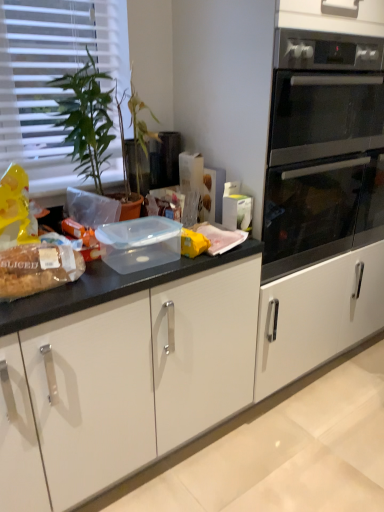
From the picture: Measure the distance between point (107, 108) and camera.

Point (107, 108) is 4.90 feet away from camera.

Locate an element on the screen. This screenshot has width=384, height=512. green glossy plant at left is located at coordinates (86, 118).

Where is `translucent plastic bread at left`? This screenshot has width=384, height=512. translucent plastic bread at left is located at coordinates (37, 269).

The height and width of the screenshot is (512, 384). What do you see at coordinates (51, 76) in the screenshot? I see `white plastic blinds at upper left` at bounding box center [51, 76].

Consider the image. In order to face white plastic blinds at upper left, should I rotate leftwards or rightwards?

It's best to rotate left around 17.920 degrees.

Where is `green glossy plant at left`? This screenshot has width=384, height=512. green glossy plant at left is located at coordinates (86, 118).

Considering the positions of point (56, 26) and point (91, 55), is point (56, 26) closer or farther from the camera than point (91, 55)?

Point (56, 26).

Does white plastic blinds at upper left have a lesser width compared to green glossy plant at left?

Yes.

From the image's perspective, is translucent plastic bread at left located above or below white plastic blinds at upper left?

translucent plastic bread at left is situated lower than white plastic blinds at upper left in the image.

Between translucent plastic bread at left and white plastic blinds at upper left, which one has smaller width?

white plastic blinds at upper left is thinner.

Consider the image. Who is bigger, translucent plastic bread at left or white plastic blinds at upper left?

white plastic blinds at upper left is bigger.

Can you confirm if white plastic blinds at upper left is smaller than translucent plastic bread at left?

No, white plastic blinds at upper left is not smaller than translucent plastic bread at left.

How distant is white plastic blinds at upper left from translucent plastic bread at left?

The distance of white plastic blinds at upper left from translucent plastic bread at left is 30.85 inches.

From a real-world perspective, is white plastic blinds at upper left above or below translucent plastic bread at left?

white plastic blinds at upper left is situated higher than translucent plastic bread at left in the real world.

Is white plastic blinds at upper left spatially inside translucent plastic bread at left, or outside of it?

The correct answer is: outside.

Does stainless steel oven at right come behind translucent plastic bread at left?

Yes, the depth of stainless steel oven at right is greater than that of translucent plastic bread at left.

Would you say stainless steel oven at right is outside translucent plastic bread at left?

Yes.

Is stainless steel oven at right far away from translucent plastic bread at left?

No, stainless steel oven at right is in close proximity to translucent plastic bread at left.

From the image's perspective, which one is positioned lower, green glossy plant at left or stainless steel oven at right?

green glossy plant at left appears lower in the image.

Can you tell me how much green glossy plant at left and stainless steel oven at right differ in facing direction?

The facing directions of green glossy plant at left and stainless steel oven at right are 6.17 degrees apart.

Does point (99, 83) lie in front of point (321, 34)?

That is False.

Considering the sizes of objects green glossy plant at left and stainless steel oven at right in the image provided, who is shorter, green glossy plant at left or stainless steel oven at right?

Standing shorter between the two is green glossy plant at left.

Where is `oven on the right of translucent plastic bread at left`? oven on the right of translucent plastic bread at left is located at coordinates (323, 148).

From a real-world perspective, is translucent plastic bread at left above or below stainless steel oven at right?

Clearly, from a real-world perspective, translucent plastic bread at left is below stainless steel oven at right.

Does point (36, 251) lie in front of point (287, 271)?

Yes, point (36, 251) is in front of point (287, 271).

Considering the sizes of translucent plastic bread at left and stainless steel oven at right in the image, is translucent plastic bread at left taller or shorter than stainless steel oven at right?

Considering their sizes, translucent plastic bread at left has less height than stainless steel oven at right.

From the picture: Between green glossy plant at left and translucent plastic bread at left, which one has larger size?

green glossy plant at left is bigger.

Is green glossy plant at left facing towards translucent plastic bread at left?

No, green glossy plant at left is not facing towards translucent plastic bread at left.

In terms of height, does green glossy plant at left look taller or shorter compared to translucent plastic bread at left?

Considering their sizes, green glossy plant at left has more height than translucent plastic bread at left.

Based on their positions, is green glossy plant at left located to the left or right of translucent plastic bread at left?

In the image, green glossy plant at left appears on the right side of translucent plastic bread at left.

Find the location of a particular element. houseplant lying below the white plastic blinds at upper left (from the image's perspective) is located at coordinates 86,118.

Find the location of a particular element. This screenshot has width=384, height=512. food located underneath the white plastic blinds at upper left (from a real-world perspective) is located at coordinates (37, 269).

From the image, which object appears to be farther from translucent plastic bread at left, stainless steel oven at right or white plastic blinds at upper left?

stainless steel oven at right is positioned further to the anchor translucent plastic bread at left.

Based on the photo, from the image, which object appears to be farther from stainless steel oven at right, green glossy plant at left or translucent plastic bread at left?

translucent plastic bread at left is positioned further to the anchor stainless steel oven at right.

Considering their positions, is translucent plastic bread at left positioned further to stainless steel oven at right than green glossy plant at left?

Based on the image, translucent plastic bread at left appears to be further to stainless steel oven at right.

Based on the photo, which object lies nearer to the anchor point translucent plastic bread at left, white plastic blinds at upper left or stainless steel oven at right?

white plastic blinds at upper left is positioned closer to the anchor translucent plastic bread at left.

Estimate the real-world distances between objects in this image. Which object is further from stainless steel oven at right, green glossy plant at left or white plastic blinds at upper left?

Based on the image, white plastic blinds at upper left appears to be further to stainless steel oven at right.

Considering their positions, is translucent plastic bread at left positioned further to green glossy plant at left than white plastic blinds at upper left?

Among the two, translucent plastic bread at left is located further to green glossy plant at left.

Looking at the image, which one is located closer to white plastic blinds at upper left, green glossy plant at left or translucent plastic bread at left?

green glossy plant at left is closer to white plastic blinds at upper left.

Considering their positions, is translucent plastic bread at left positioned closer to green glossy plant at left than stainless steel oven at right?

translucent plastic bread at left lies closer to green glossy plant at left than the other object.

The image size is (384, 512). I want to click on food situated between white plastic blinds at upper left and stainless steel oven at right from left to right, so click(x=37, y=269).

Identify the location of houseplant between white plastic blinds at upper left and stainless steel oven at right in the horizontal direction. (86, 118).

Locate an element on the screen. houseplant between translucent plastic bread at left and stainless steel oven at right in the horizontal direction is located at coordinates (86, 118).

Locate an element on the screen. houseplant between white plastic blinds at upper left and translucent plastic bread at left vertically is located at coordinates (86, 118).